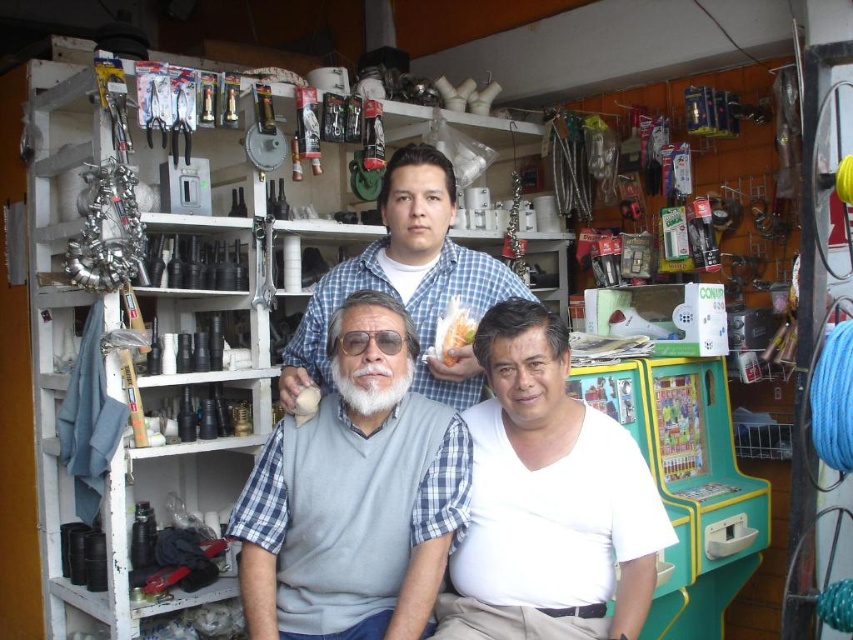
Question: Is gray matte vest at center to the left of blue plaid shirt at center from the viewer's perspective?

Choices:
 (A) no
 (B) yes

Answer: (B)

Question: Can you confirm if gray matte vest at center is positioned above white matte shirt at center?

Choices:
 (A) no
 (B) yes

Answer: (B)

Question: Considering the real-world distances, which object is farthest from the white matte shirt at center?

Choices:
 (A) gray matte vest at center
 (B) blue plaid shirt at center

Answer: (B)

Question: Among these objects, which one is farthest from the camera?

Choices:
 (A) blue plaid shirt at center
 (B) white matte shirt at center

Answer: (A)

Question: Considering the relative positions of gray matte vest at center and white matte shirt at center in the image provided, where is gray matte vest at center located with respect to white matte shirt at center?

Choices:
 (A) above
 (B) below

Answer: (A)

Question: Considering the real-world distances, which object is closest to the gray matte vest at center?

Choices:
 (A) blue plaid shirt at center
 (B) white matte shirt at center

Answer: (B)